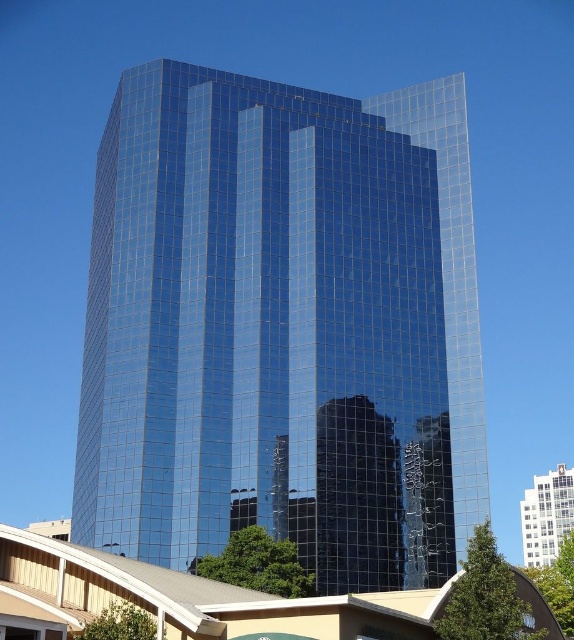
You are an architect planning to construct a new building that must not exceed the height of the tallest structure in the area. Based on the image, which of the two buildings, the glossy glass tower at center or the white glossy building at upper center, should you use as a reference for maximum height?

The glossy glass tower at center is taller than the white glossy building at upper center, so you should use the glossy glass tower at center as the reference for maximum height to ensure compliance with height restrictions.

You are standing at the base of the skyscraper and want to take a photo of the point located at coordinates point (x=292, y=380). If your camera has a maximum zoom range of 50 meters, can you clearly capture the point in your photo?

The point (x=292, y=380) is 69.40 meters away from the viewer. Since the camera can only zoom up to 50 meters, it cannot clearly capture the point in the photo.

You are standing in front of the skyscraper and notice two points marked on the glass facade. The first point is at coordinates point (76, 467) and the second is at point (546, 486). Which point is closer to your position?

Point (76, 467) is closer to the camera than point (546, 486), so the first point is closer to your position.